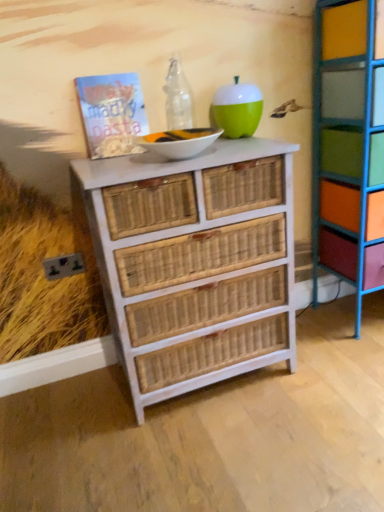
You are a GUI agent. You are given a task and a screenshot of the screen. Output one action in this format:
    pyautogui.click(x=<x>, y=<y>)
    Task: Click on the vacant space to the left of multicolored painted wood shelf at right
    
    Given the screenshot: What is the action you would take?
    pyautogui.click(x=314, y=334)